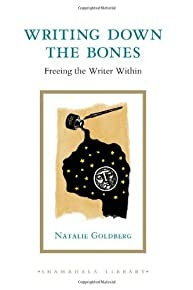
This screenshot has width=193, height=290. What are the coordinates of `gold border` in the screenshot? It's located at (40, 180).